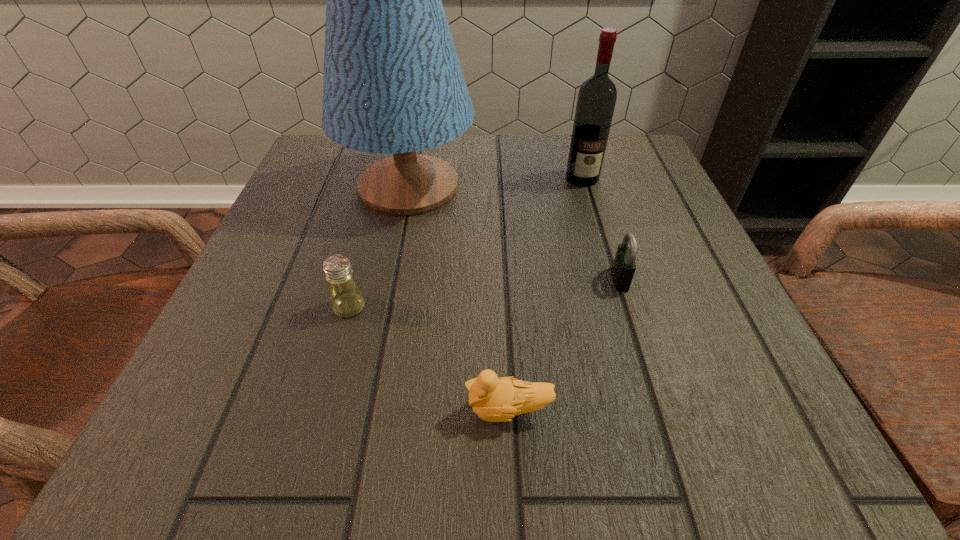
Identify the location of lampshade. The height and width of the screenshot is (540, 960). (393, 84).

You are a GUI agent. You are given a task and a screenshot of the screen. Output one action in this format:
    pyautogui.click(x=<x>, y=<y>)
    Task: Click on the fourth shortest object
    The height and width of the screenshot is (540, 960).
    Given the screenshot: What is the action you would take?
    pyautogui.click(x=597, y=96)

The height and width of the screenshot is (540, 960). Find the location of `the fourth farthest object`. the fourth farthest object is located at coordinates point(346,298).

Where is `padlock`? This screenshot has height=540, width=960. padlock is located at coordinates (623, 269).

The height and width of the screenshot is (540, 960). What are the coordinates of `duckling` in the screenshot? It's located at (493, 399).

This screenshot has height=540, width=960. I want to click on vacant space located on the right of the tallest object, so click(510, 186).

At what (x,y) coordinates should I click in order to perform the action: click on free space located on the front and back of the alcohol. Please return your answer as a coordinate pair (x, y). Looking at the image, I should click on 592,212.

Where is `vacant space located 0.120m on the right of the saltshaker`? vacant space located 0.120m on the right of the saltshaker is located at coordinates (445, 307).

What are the coordinates of `free location located on the left of the padlock` in the screenshot? It's located at (518, 279).

Identify the location of vacant space located on the face of the nearest object. The height and width of the screenshot is (540, 960). (206, 410).